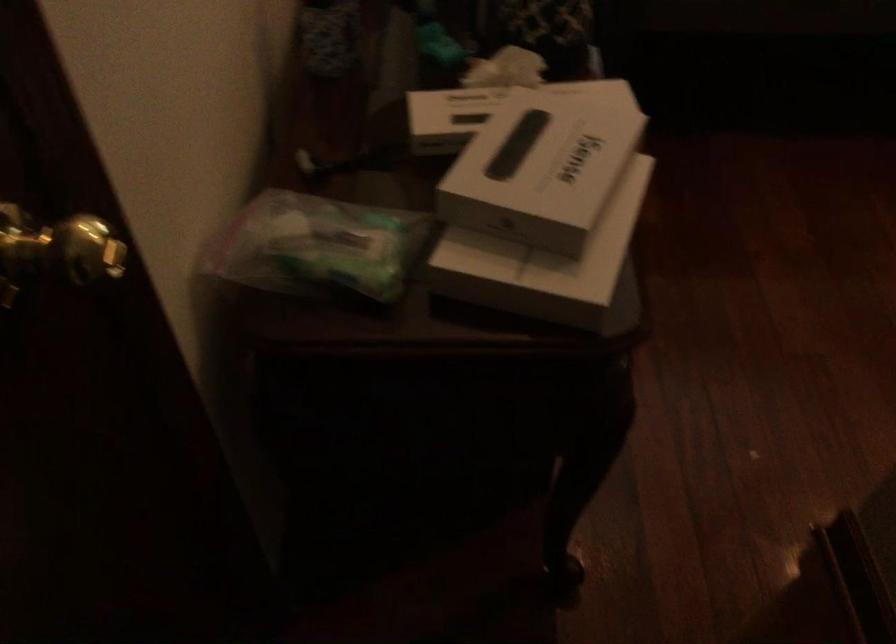
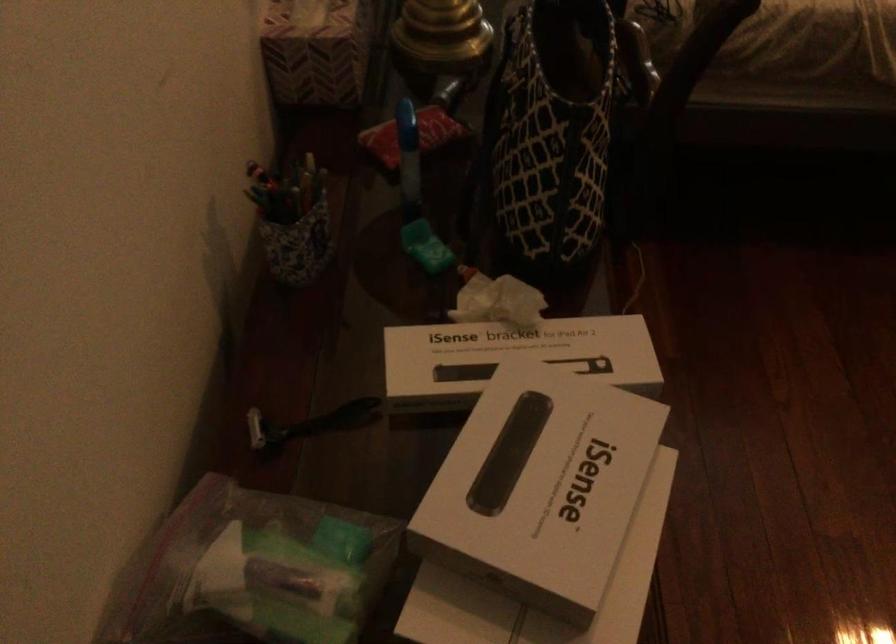
Find the pixel in the second image that matches point 349,156 in the first image.

(309, 422)